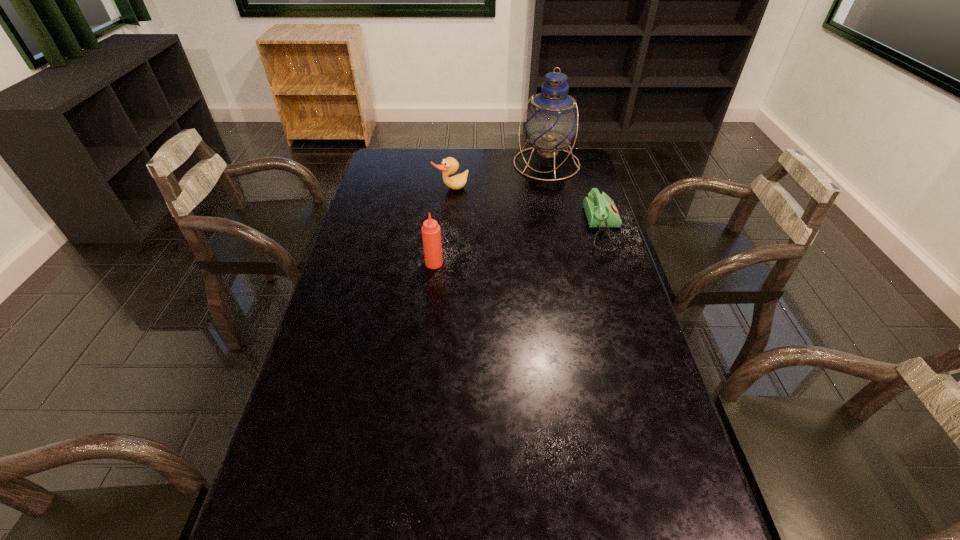
At what (x,y) coordinates should I click in order to perform the action: click on the third closest object relative to the second tallest object. Please return your answer as a coordinate pair (x, y). The width and height of the screenshot is (960, 540). Looking at the image, I should click on (551, 122).

Locate an element on the screen. Image resolution: width=960 pixels, height=540 pixels. the third closest object relative to the telephone is located at coordinates (431, 234).

At what (x,y) coordinates should I click in order to perform the action: click on vacant space that satisfies the following two spatial constraints: 1. on the front side of the telephone; 2. on the dial of the lantern. Please return your answer as a coordinate pair (x, y). The height and width of the screenshot is (540, 960). Looking at the image, I should click on (561, 230).

At what (x,y) coordinates should I click in order to perform the action: click on vacant position in the image that satisfies the following two spatial constraints: 1. on the front side of the shortest object; 2. on the dial of the duck. Please return your answer as a coordinate pair (x, y). This screenshot has height=540, width=960. Looking at the image, I should click on (447, 230).

I want to click on vacant area that satisfies the following two spatial constraints: 1. on the front side of the telephone; 2. on the dial of the tallest object, so click(561, 230).